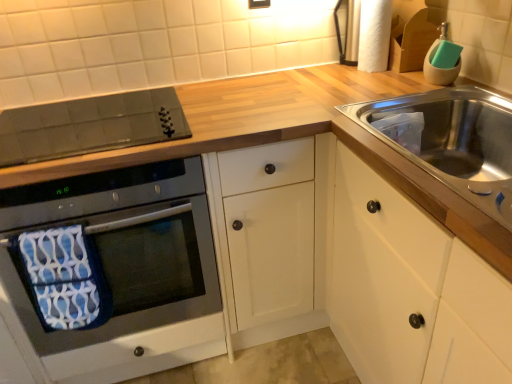
You are a GUI agent. You are given a task and a screenshot of the screen. Output one action in this format:
    pyautogui.click(x=<x>, y=<y>)
    Task: Click on the matte black electric outlet at upper center
    This screenshot has width=512, height=384.
    Given the screenshot: What is the action you would take?
    pyautogui.click(x=258, y=4)

Image resolution: width=512 pixels, height=384 pixels. What do you see at coordinates (110, 256) in the screenshot?
I see `black glass oven at left` at bounding box center [110, 256].

What is the approximate height of white wood cabinet at right?

white wood cabinet at right is 36.43 inches in height.

Where is `white wood cabinet at right`? white wood cabinet at right is located at coordinates (411, 290).

Locate an element on the screen. The height and width of the screenshot is (384, 512). matte black electric outlet at upper center is located at coordinates (258, 4).

Is matte black electric outlet at upper center oriented away from white wood cabinet at right?

No, matte black electric outlet at upper center is not facing away from white wood cabinet at right.

From a real-world perspective, is matte black electric outlet at upper center beneath white wood cabinet at right?

Incorrect, from a real-world perspective, matte black electric outlet at upper center is higher than white wood cabinet at right.

Who is bigger, matte black electric outlet at upper center or white wood cabinet at right?

white wood cabinet at right is bigger.

Considering the positions of objects matte black electric outlet at upper center and white wood cabinet at right in the image provided, who is more to the right, matte black electric outlet at upper center or white wood cabinet at right?

white wood cabinet at right.

Choose the correct answer: Is white wood cabinet at right inside black glass oven at left or outside it?

white wood cabinet at right is outside black glass oven at left.

From a real-world perspective, is white wood cabinet at right physically located above or below black glass oven at left?

In terms of real-world spatial position, white wood cabinet at right is below black glass oven at left.

How many degrees apart are the facing directions of white wood cabinet at right and black glass oven at left?

There is a 89.3-degree angle between the facing directions of white wood cabinet at right and black glass oven at left.

From the image's perspective, who appears lower, white wood cabinet at right or black glass oven at left?

white wood cabinet at right appears lower in the image.

Can you confirm if white textured toilet paper at upper right is positioned to the right of white wood cabinet at right?

No.

Which of these two, white textured toilet paper at upper right or white wood cabinet at right, is smaller?

white textured toilet paper at upper right.

Does white textured toilet paper at upper right contain white wood cabinet at right?

Definitely not — white wood cabinet at right is not inside white textured toilet paper at upper right.

From the image's perspective, would you say white textured toilet paper at upper right is positioned over white wood cabinet at right?

Correct, white textured toilet paper at upper right appears higher than white wood cabinet at right in the image.

In the scene shown: Is white wood cabinet at right bigger than white textured toilet paper at upper right?

Correct, white wood cabinet at right is larger in size than white textured toilet paper at upper right.

Considering the sizes of objects white wood cabinet at right and white textured toilet paper at upper right in the image provided, who is shorter, white wood cabinet at right or white textured toilet paper at upper right?

white textured toilet paper at upper right.

How many degrees apart are the facing directions of white wood cabinet at right and white textured toilet paper at upper right?

There is a 3.05-degree angle between the facing directions of white wood cabinet at right and white textured toilet paper at upper right.

Between white wood cabinet at right and white textured toilet paper at upper right, which one appears on the left side from the viewer's perspective?

From the viewer's perspective, white textured toilet paper at upper right appears more on the left side.

Who is taller, matte black electric outlet at upper center or white textured toilet paper at upper right?

white textured toilet paper at upper right is taller.

Considering the sizes of matte black electric outlet at upper center and white textured toilet paper at upper right in the image, is matte black electric outlet at upper center bigger or smaller than white textured toilet paper at upper right?

Considering their sizes, matte black electric outlet at upper center takes up less space than white textured toilet paper at upper right.

Is matte black electric outlet at upper center far away from white textured toilet paper at upper right?

matte black electric outlet at upper center is actually quite close to white textured toilet paper at upper right.

Between matte black electric outlet at upper center and white textured toilet paper at upper right, which one is positioned behind?

matte black electric outlet at upper center.

Is matte black electric outlet at upper center wider or thinner than black glass oven at left?

matte black electric outlet at upper center is thinner than black glass oven at left.

Which is correct: matte black electric outlet at upper center is inside black glass oven at left, or outside of it?

matte black electric outlet at upper center is spatially situated outside black glass oven at left.

Is matte black electric outlet at upper center facing away from black glass oven at left?

No, matte black electric outlet at upper center is not facing away from black glass oven at left.

Is matte black electric outlet at upper center shorter than black glass oven at left?

Yes.

Where is `toilet paper on the right of black glass oven at left`? This screenshot has height=384, width=512. toilet paper on the right of black glass oven at left is located at coordinates (374, 35).

Considering the relative sizes of black glass oven at left and white textured toilet paper at upper right in the image provided, is black glass oven at left thinner than white textured toilet paper at upper right?

In fact, black glass oven at left might be wider than white textured toilet paper at upper right.

Can you tell me how much black glass oven at left and white textured toilet paper at upper right differ in facing direction?

The angle between the facing direction of black glass oven at left and the facing direction of white textured toilet paper at upper right is 92.4 degrees.

From a real-world perspective, which is physically above, black glass oven at left or white textured toilet paper at upper right?

From a 3D spatial view, white textured toilet paper at upper right is above.

Identify the location of cabinetry that is on the right side of matte black electric outlet at upper center. (411, 290).

Find the location of a particular element. The image size is (512, 384). oven behind the white wood cabinet at right is located at coordinates (110, 256).

Looking at this image, estimate the real-world distances between objects in this image. Which object is closer to black glass cooktop at upper left, white textured toilet paper at upper right or black glass oven at left?

Based on the image, black glass oven at left appears to be nearer to black glass cooktop at upper left.

Which object lies nearer to the anchor point black glass cooktop at upper left, white textured toilet paper at upper right or white wood cabinet at right?

The object closer to black glass cooktop at upper left is white wood cabinet at right.

Considering their positions, is white wood cabinet at right positioned further to matte black electric outlet at upper center than white textured toilet paper at upper right?

white wood cabinet at right lies further to matte black electric outlet at upper center than the other object.

When comparing their distances from matte black electric outlet at upper center, does black glass oven at left or black glass cooktop at upper left seem closer?

black glass cooktop at upper left is closer to matte black electric outlet at upper center.

From the image, which object appears to be farther from black glass oven at left, black glass cooktop at upper left or white textured toilet paper at upper right?

white textured toilet paper at upper right.

Based on their spatial positions, is black glass oven at left or white wood cabinet at right closer to matte black electric outlet at upper center?

black glass oven at left is positioned closer to the anchor matte black electric outlet at upper center.

From the image, which object appears to be farther from white textured toilet paper at upper right, matte black electric outlet at upper center or white wood cabinet at right?

The object further to white textured toilet paper at upper right is white wood cabinet at right.

Which object lies nearer to the anchor point white textured toilet paper at upper right, matte black electric outlet at upper center or black glass cooktop at upper left?

matte black electric outlet at upper center.

Locate an element on the screen. The image size is (512, 384). electric outlet between black glass cooktop at upper left and white wood cabinet at right is located at coordinates (258, 4).

The width and height of the screenshot is (512, 384). Identify the location of toilet paper between black glass oven at left and white wood cabinet at right from left to right. (374, 35).

Where is `electric outlet between black glass cooktop at upper left and white textured toilet paper at upper right`? The width and height of the screenshot is (512, 384). electric outlet between black glass cooktop at upper left and white textured toilet paper at upper right is located at coordinates (258, 4).

At what (x,y) coordinates should I click in order to perform the action: click on electric outlet between black glass oven at left and white textured toilet paper at upper right. Please return your answer as a coordinate pair (x, y). Looking at the image, I should click on (258, 4).